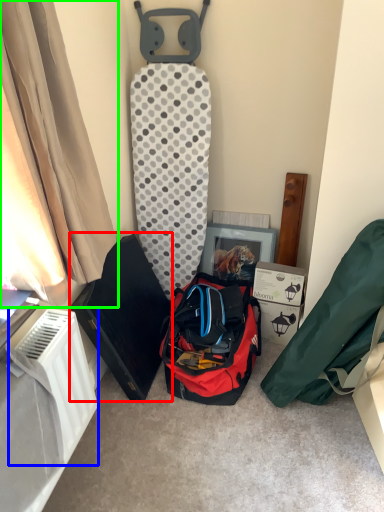
Question: Which is nearer to the kit (highlighted by a red box)? radiator (highlighted by a blue box) or curtain (highlighted by a green box).

Choices:
 (A) radiator
 (B) curtain

Answer: (A)